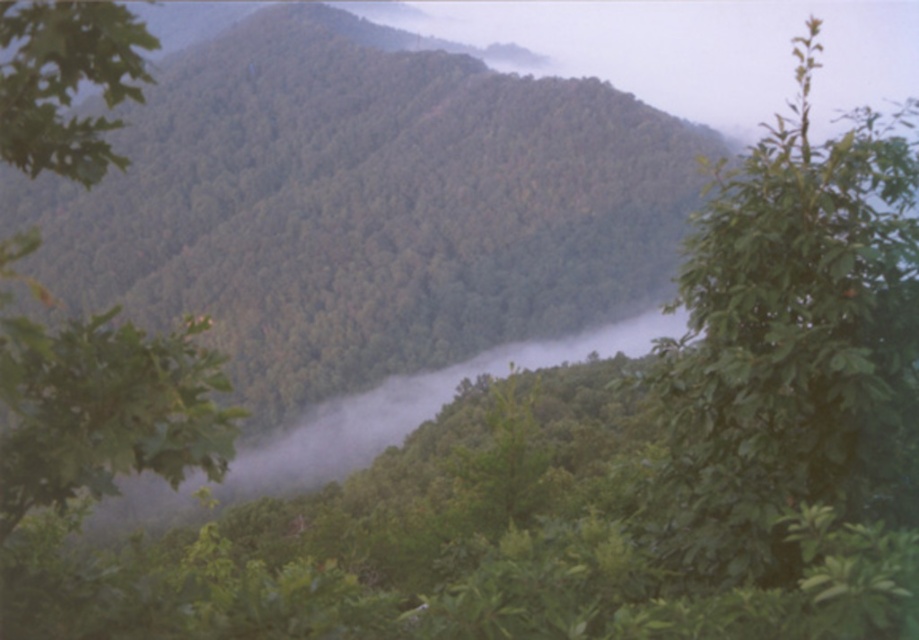
You are an observer standing in the middle of the valley. You see the green leafy tree at right and the green leafy tree at upper left. Which tree has a larger width from your perspective?

The green leafy tree at right might be wider than the green leafy tree at upper left according to the description.

You are standing in the serene misty landscape described. You see a point marked at coordinates (792, 346). What object does this point correspond to?

The point at coordinates (792, 346) corresponds to the green leafy tree at right.